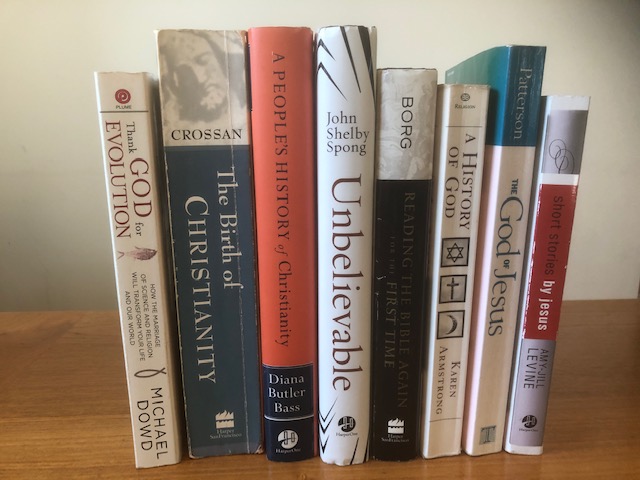
This screenshot has height=480, width=640. In order to click on religious book in this screenshot , I will do `click(140, 331)`, `click(227, 328)`, `click(301, 321)`, `click(355, 324)`, `click(397, 321)`, `click(448, 312)`, `click(496, 317)`, `click(538, 324)`.